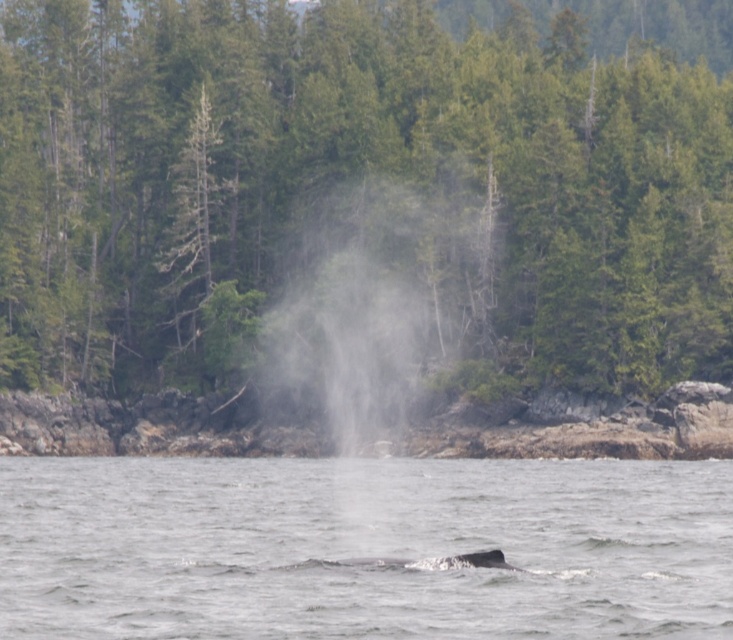
You are navigating a small boat on the water in the scene and need to reach a destination located at point (334, 502). There is an obstacle at point (504, 228). Based on their positions, will you encounter the obstacle before reaching your destination?

Point (504, 228) is behind point (334, 502), so you will reach the destination at point (334, 502) before encountering the obstacle at point (504, 228). Therefore, you will not encounter the obstacle before reaching your destination.

You are a hiker standing at the edge of the forest. You see the green leafy tree at center and the gray spotted whale at lower center. Which object is positioned to the right of the other?

The green leafy tree at center is positioned to the right of the gray spotted whale at lower center.